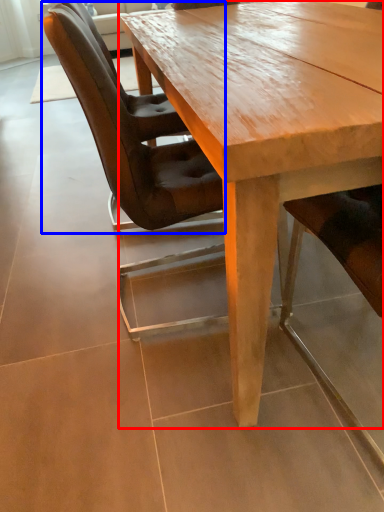
Question: Which of the following is the closest to the observer, coffee table (highlighted by a red box) or chair (highlighted by a blue box)?

Choices:
 (A) coffee table
 (B) chair

Answer: (A)